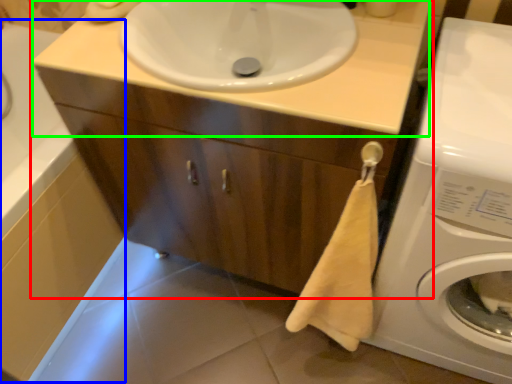
Question: Which object is positioned closest to bathroom cabinet (highlighted by a red box)? Select from bath (highlighted by a blue box) and counter top (highlighted by a green box).

Choices:
 (A) bath
 (B) counter top

Answer: (B)